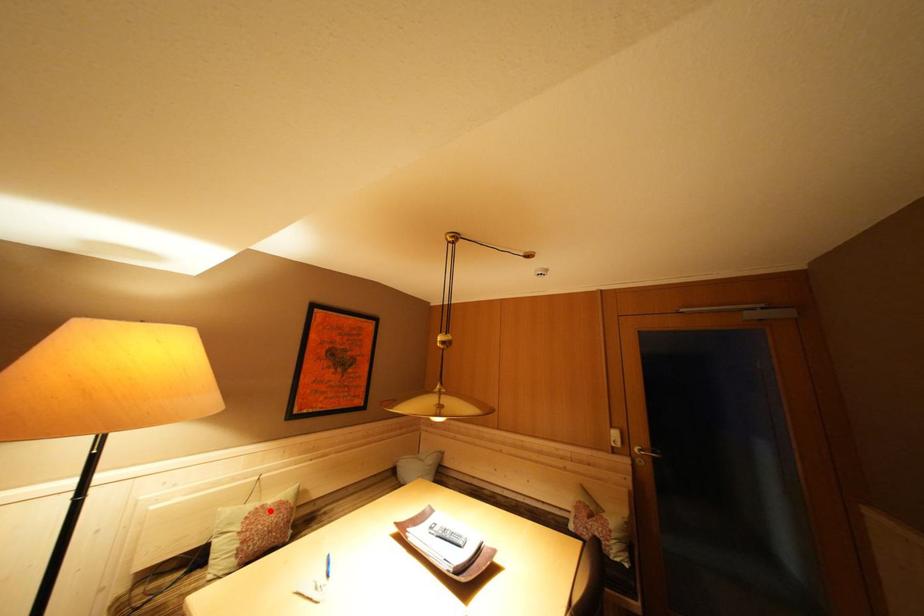
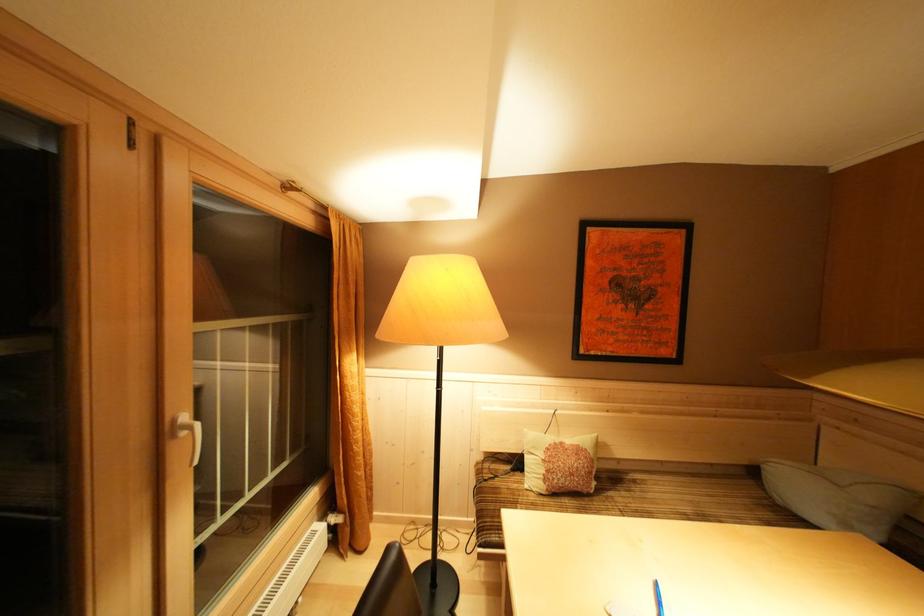
In the second image, find the point that corresponds to the highlighted location in the first image.

(568, 448)